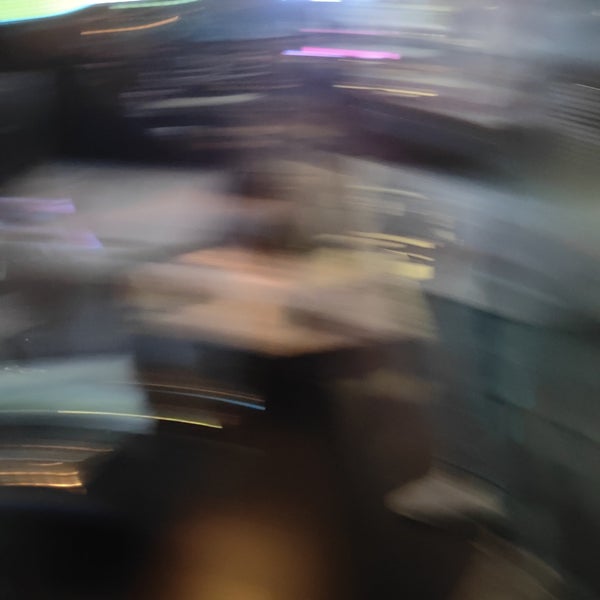
Locate an element on the screen. This screenshot has width=600, height=600. blurry yellow light is located at coordinates (207, 426), (147, 417), (68, 412), (410, 243).